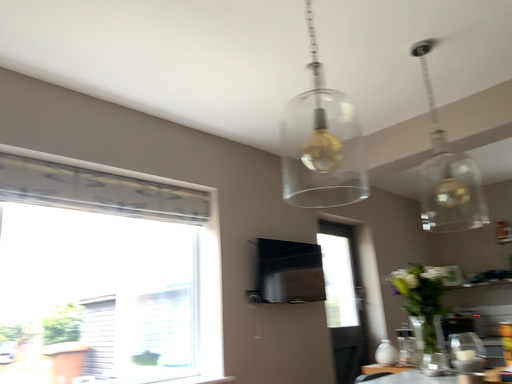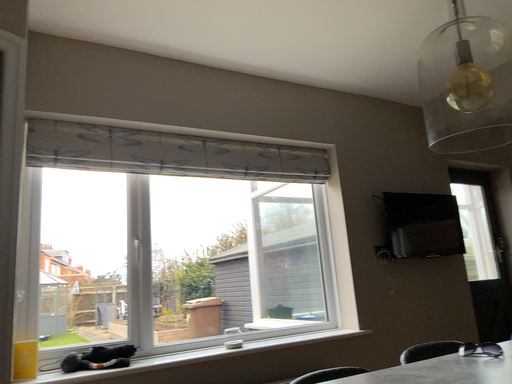
Question: How did the camera likely rotate when shooting the video?

Choices:
 (A) rotated left
 (B) rotated right

Answer: (A)